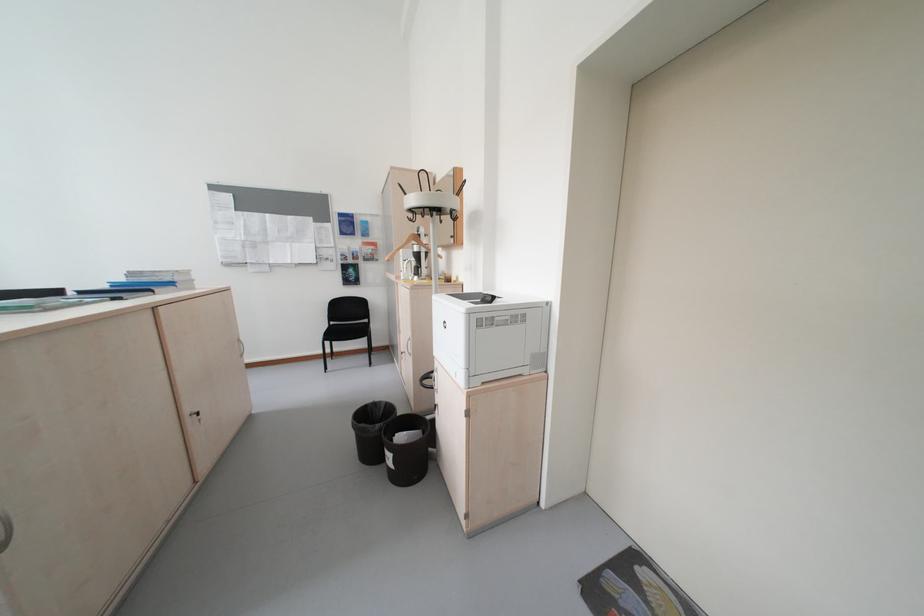
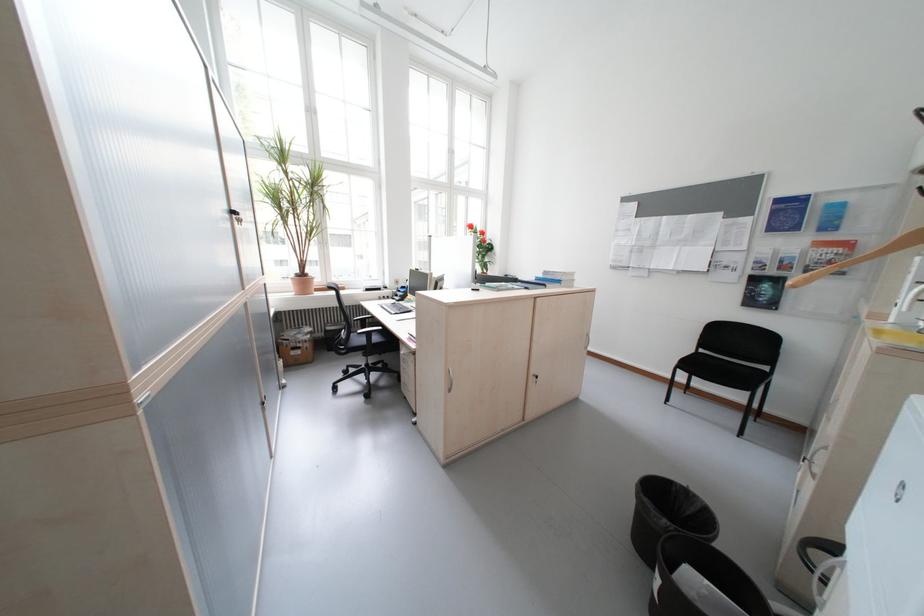
Locate, in the second image, the point that corresponds to point 372,427 in the first image.

(655, 501)